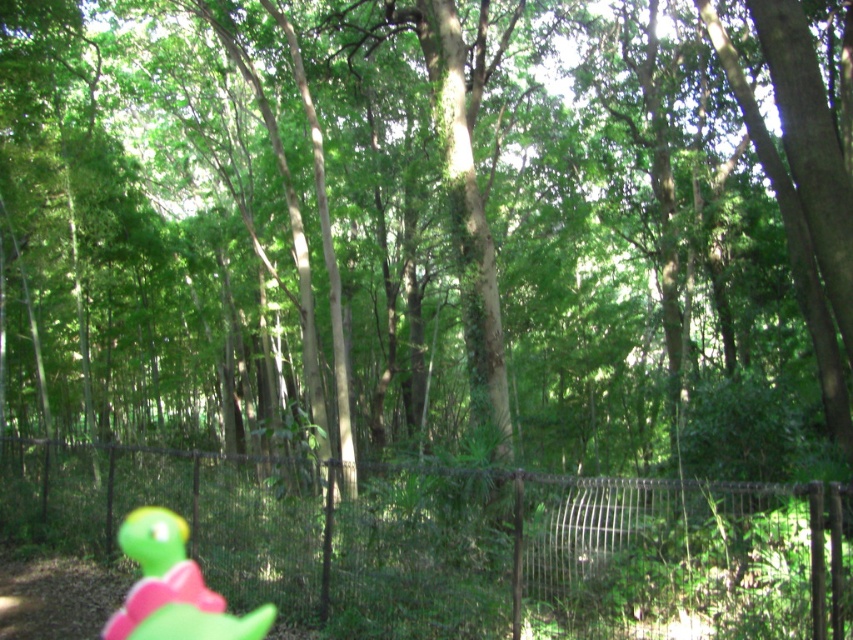
Is black metal fence at center closer to the viewer compared to green rubber turtle at lower left?

Yes.

Who is more forward, (274,586) or (151,552)?

Point (274,586) is more forward.

Identify the location of black metal fence at center. pyautogui.click(x=467, y=541).